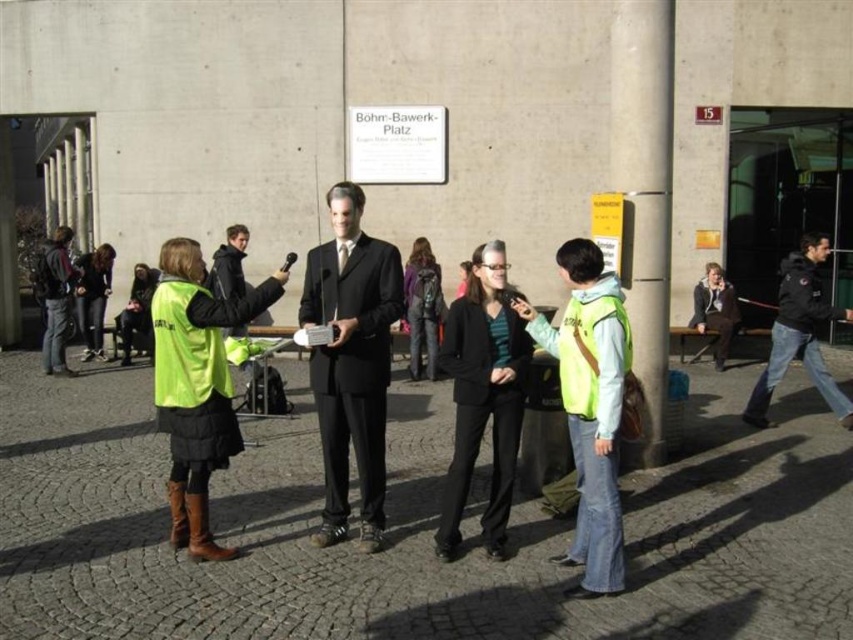
Question: Estimate the real-world distances between objects in this image. Which object is closer to the neon yellow safety vest at left?

Choices:
 (A) matte black suit at center
 (B) reflective yellow vest at center

Answer: (A)

Question: Among these points, which one is nearest to the camera?

Choices:
 (A) (187, 362)
 (B) (788, 257)

Answer: (A)

Question: Can you confirm if neon yellow vest at center is smaller than reflective yellow vest at center?

Choices:
 (A) yes
 (B) no

Answer: (B)

Question: Can you confirm if matte black suit at center is smaller than black smooth pants at center?

Choices:
 (A) yes
 (B) no

Answer: (B)

Question: Does matte black suit at center have a smaller size compared to neon yellow safety vest at left?

Choices:
 (A) yes
 (B) no

Answer: (B)

Question: Which object appears closest to the camera in this image?

Choices:
 (A) matte black suit at center
 (B) black leather jacket at right
 (C) neon yellow safety vest at left
 (D) light brown leather jacket at center

Answer: (C)